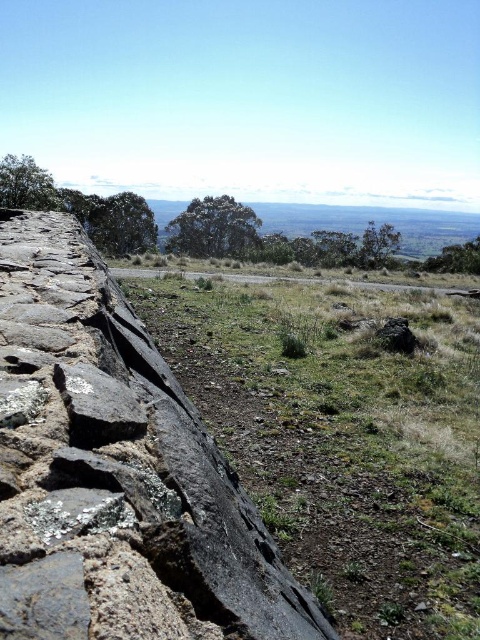
Between dark gray stone wall at left and gray rock at center, which one has more height?

dark gray stone wall at left

Is point (36, 353) farther from camera compared to point (321, 483)?

No, (36, 353) is closer to viewer.

Is point (142, 426) positioned in front of point (262, 376)?

Yes, point (142, 426) is closer to viewer.

You are a GUI agent. You are given a task and a screenshot of the screen. Output one action in this format:
    pyautogui.click(x=<x>, y=<y>)
    Task: Click on the dark gray stone wall at left
    This screenshot has height=640, width=480.
    Given the screenshot: What is the action you would take?
    pyautogui.click(x=116, y=470)